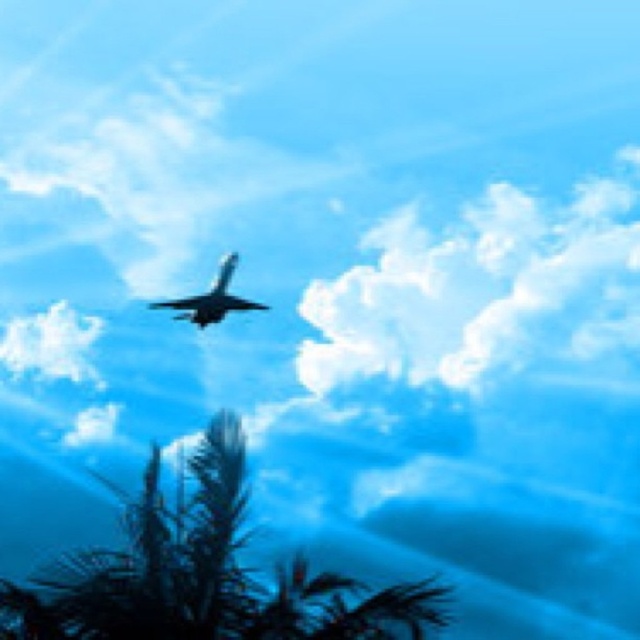
You are a pilot flying the shiny silver airplane at center. You want to navigate around the white fluffy cloud at upper center. In which direction should you turn to avoid it?

The white fluffy cloud at upper center is to the right of the shiny silver airplane at center, so you should turn left to avoid it.

From the picture: You are observing the aircraft and palm trees in the image. Which of the two points, point [330,636] or point [177,317], is nearer to your viewpoint?

Point [330,636] is closer to the camera than point [177,317], so it is nearer to your viewpoint.

You are a drone operator trying to navigate a drone between the aircraft silhouette and the white fluffy cloud at upper center. The drone has a maximum flight distance of 25 meters. Can the drone safely travel between them without exceeding its limit?

The distance between the aircraft silhouette and the white fluffy cloud at upper center is 24.55 meters, which is under the drone operator s 25 meter limit. Yes, the drone can safely travel between them without exceeding its limit.